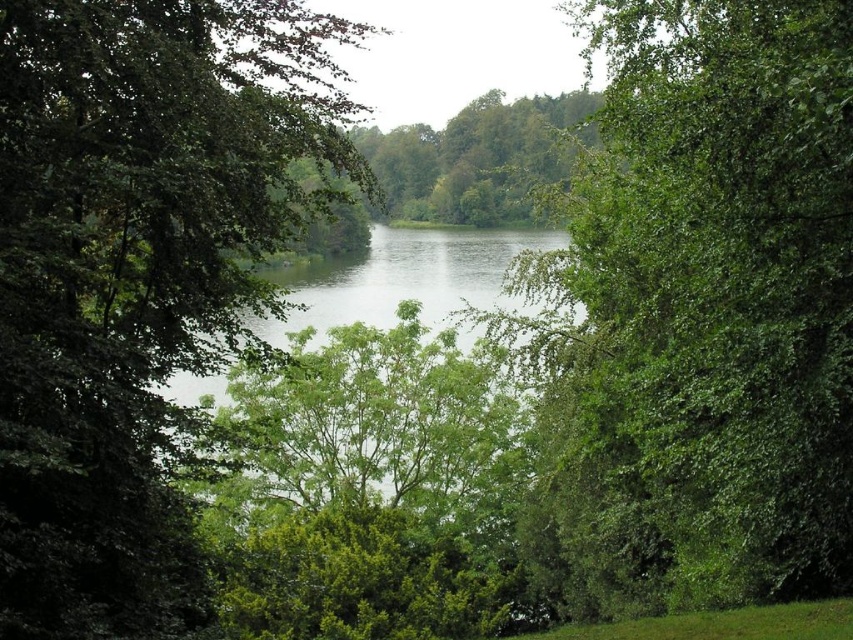
Which is more to the right, green leafy tree at center or green leafy tree at left?

green leafy tree at center

Is point (579, 522) closer to camera compared to point (105, 100)?

No, (579, 522) is further to viewer.

You are a GUI agent. You are given a task and a screenshot of the screen. Output one action in this format:
    pyautogui.click(x=<x>, y=<y>)
    Task: Click on the green leafy tree at center
    
    Given the screenshot: What is the action you would take?
    pyautogui.click(x=700, y=314)